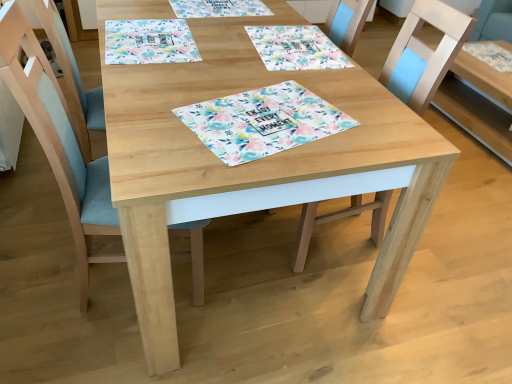
Question: Can you confirm if floral paper placemat at center is positioned to the right of floral fabric placemat at upper center?

Choices:
 (A) yes
 (B) no

Answer: (B)

Question: From a real-world perspective, is floral paper placemat at center positioned over floral fabric placemat at upper center based on gravity?

Choices:
 (A) yes
 (B) no

Answer: (A)

Question: From a real-world perspective, is floral paper placemat at center under floral fabric placemat at upper center?

Choices:
 (A) yes
 (B) no

Answer: (B)

Question: Is floral paper placemat at center thinner than floral fabric placemat at upper center?

Choices:
 (A) yes
 (B) no

Answer: (A)

Question: Considering the relative sizes of floral paper placemat at center and floral fabric placemat at upper center in the image provided, is floral paper placemat at center taller than floral fabric placemat at upper center?

Choices:
 (A) no
 (B) yes

Answer: (A)

Question: Does point (329, 218) appear closer or farther from the camera than point (456, 64)?

Choices:
 (A) closer
 (B) farther

Answer: (A)

Question: Looking at their shapes, would you say wooden chair at center, acting as the 2th chair starting from the left, is wider or thinner than natural wood table at right, acting as the second table starting from the left?

Choices:
 (A) thin
 (B) wide

Answer: (A)

Question: From the image's perspective, is wooden chair at center, acting as the 2th chair starting from the left, located above or below natural wood table at right, which is counted as the first table, starting from the right?

Choices:
 (A) below
 (B) above

Answer: (A)

Question: Is wooden chair at center, acting as the 2th chair starting from the left, taller or shorter than natural wood table at right, acting as the second table starting from the left?

Choices:
 (A) tall
 (B) short

Answer: (A)

Question: From their relative heights in the image, would you say light blue fabric chair at left, marked as the 2th chair in a right-to-left arrangement, is taller or shorter than natural wood table at center, which is the second table in right-to-left order?

Choices:
 (A) tall
 (B) short

Answer: (A)

Question: Is light blue fabric chair at left, acting as the 1th chair starting from the left, in front of or behind natural wood table at center, which is the second table in right-to-left order, in the image?

Choices:
 (A) behind
 (B) front

Answer: (B)

Question: Is point pyautogui.click(x=112, y=218) positioned closer to the camera than point pyautogui.click(x=156, y=218)?

Choices:
 (A) farther
 (B) closer

Answer: (A)

Question: Which is correct: light blue fabric chair at left, marked as the 2th chair in a right-to-left arrangement, is inside natural wood table at center, which is the second table in right-to-left order, or outside of it?

Choices:
 (A) outside
 (B) inside

Answer: (B)

Question: In terms of size, does floral fabric placemat at upper center appear bigger or smaller than floral paper placemat at center?

Choices:
 (A) small
 (B) big

Answer: (B)

Question: Is floral fabric placemat at upper center wider or thinner than floral paper placemat at center?

Choices:
 (A) wide
 (B) thin

Answer: (A)